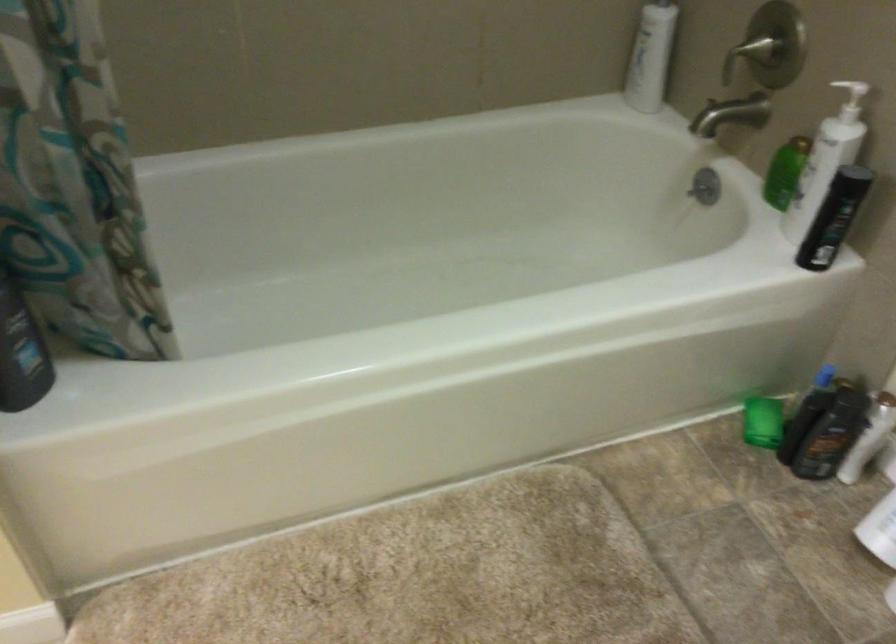
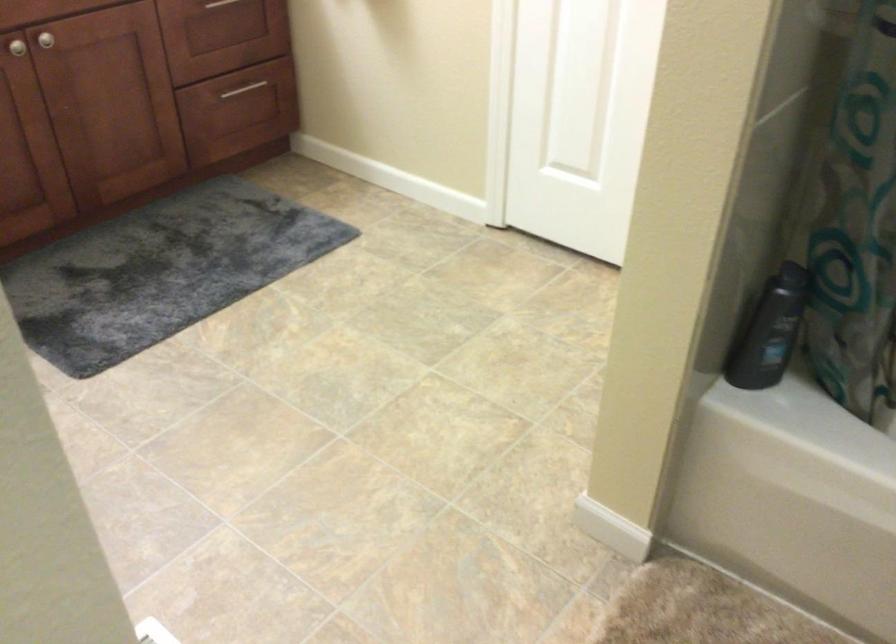
Question: The camera is either moving clockwise (left) or counter-clockwise (right) around the object. The first image is from the beginning of the video and the second image is from the end. Is the camera moving left or right when shooting the video?

Choices:
 (A) Left
 (B) Right

Answer: (B)